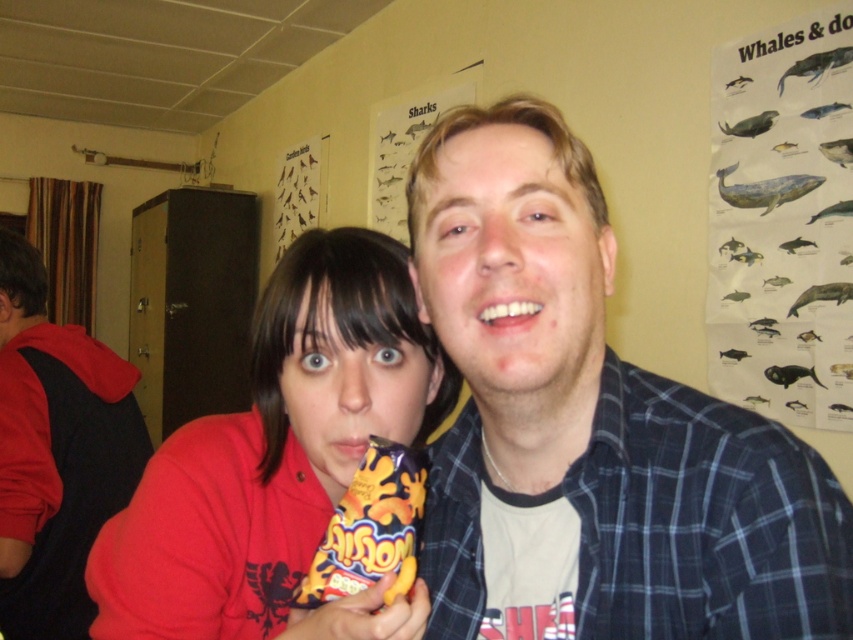
Does red fleece sweatshirt at left have a smaller size compared to yellow matte bag of crisps at center?

No, red fleece sweatshirt at left is not smaller than yellow matte bag of crisps at center.

Does red fleece sweatshirt at left appear on the right side of yellow matte bag of crisps at center?

In fact, red fleece sweatshirt at left is to the left of yellow matte bag of crisps at center.

Locate an element on the screen. red fleece sweatshirt at left is located at coordinates (56, 452).

Can you confirm if blue plaid shirt at center is positioned below matte plastic bag of chips at center?

Actually, blue plaid shirt at center is above matte plastic bag of chips at center.

Between blue plaid shirt at center and matte plastic bag of chips at center, which one is positioned lower?

matte plastic bag of chips at center is lower down.

Which is in front, point (729, 564) or point (349, 273)?

Point (729, 564) is more forward.

Find the location of a particular element. The height and width of the screenshot is (640, 853). blue plaid shirt at center is located at coordinates (590, 428).

Does point (407, 385) come closer to viewer compared to point (62, 577)?

Yes, point (407, 385) is in front of point (62, 577).

Measure the distance between matte plastic bag of chips at center and red fleece sweatshirt at left.

They are 3.55 feet apart.

Is point (374, 312) farther from viewer compared to point (53, 628)?

No.

This screenshot has width=853, height=640. I want to click on matte plastic bag of chips at center, so click(x=274, y=449).